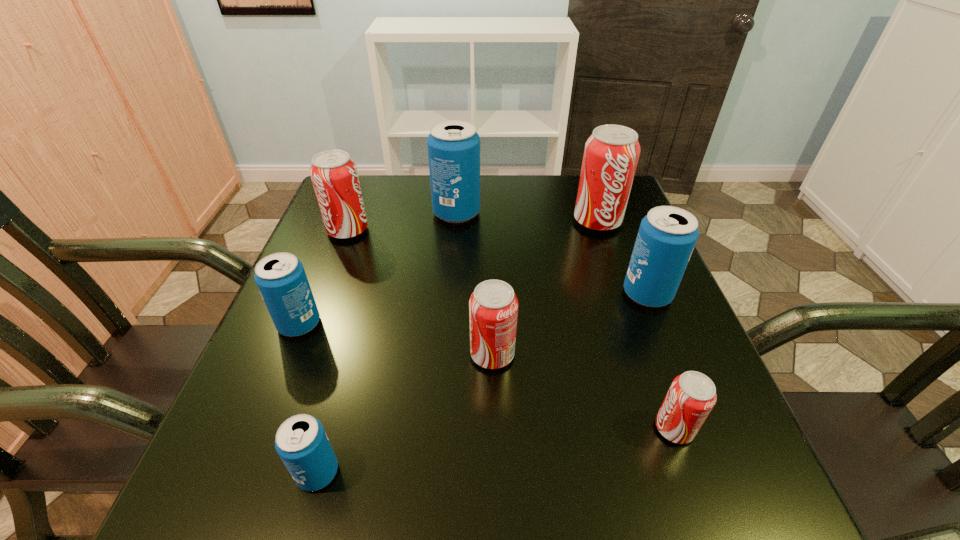
Locate an element on the screen. The width and height of the screenshot is (960, 540). vacant space at the left edge is located at coordinates (270, 354).

Image resolution: width=960 pixels, height=540 pixels. In the image, there is a desktop. Find the location of `blank space at the right edge`. blank space at the right edge is located at coordinates (631, 397).

In the image, there is a desktop. Identify the location of free space at the far left corner. tap(368, 214).

The height and width of the screenshot is (540, 960). Find the location of `free space that is in between the third red soda can from right to left and the biggest red soda can`. free space that is in between the third red soda can from right to left and the biggest red soda can is located at coordinates (545, 288).

What are the coordinates of `unoccupied position between the biggest blue soda can and the rightmost blue soda can` in the screenshot? It's located at (552, 253).

Where is `vacant region between the rightmost blue soda can and the leftmost red soda can`? This screenshot has height=540, width=960. vacant region between the rightmost blue soda can and the leftmost red soda can is located at coordinates (497, 262).

Where is `free point between the second blue soda can from right to left and the leftmost red soda can`? This screenshot has width=960, height=540. free point between the second blue soda can from right to left and the leftmost red soda can is located at coordinates coord(402,221).

This screenshot has height=540, width=960. In order to click on vacant space in between the third smallest blue soda can and the third farthest red soda can in this screenshot , I will do [570, 324].

Image resolution: width=960 pixels, height=540 pixels. I want to click on empty space that is in between the nearest object and the third smallest red soda can, so click(333, 351).

Identify the location of free space between the third soda can from left to right and the seventh farthest soda can. The image size is (960, 540). (496, 450).